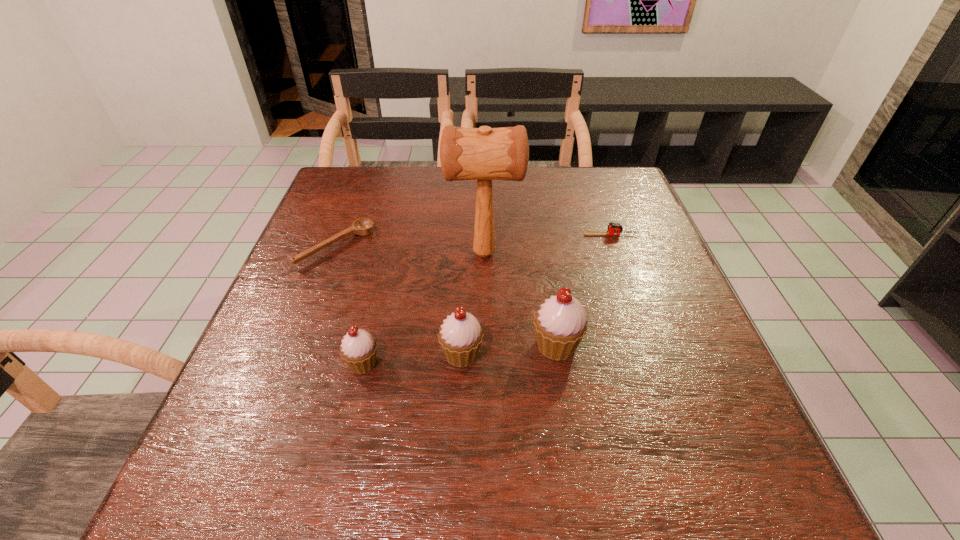
Identify the location of free space located on the back of the second cupcake from right to left. The image size is (960, 540). (466, 233).

At what (x,y) coordinates should I click in order to perform the action: click on vacant space located on the back of the rightmost cupcake. Please return your answer as a coordinate pair (x, y). The image size is (960, 540). Looking at the image, I should click on (540, 238).

The height and width of the screenshot is (540, 960). Find the location of `free region located on the strike surface of the tallest object`. free region located on the strike surface of the tallest object is located at coordinates coord(385,254).

Find the location of a particular element. vacant space located 0.240m on the strike surface of the tallest object is located at coordinates (348, 254).

Locate an element on the screen. The width and height of the screenshot is (960, 540). vacant region located on the strike surface of the tallest object is located at coordinates (336, 254).

This screenshot has width=960, height=540. What are the coordinates of `free space located 0.150m on the left of the rightmost object` in the screenshot? It's located at (526, 235).

You are a GUI agent. You are given a task and a screenshot of the screen. Output one action in this format:
    pyautogui.click(x=<x>, y=<y>)
    Task: Click on the blank space located 0.110m on the front of the leftmost object
    The image size is (960, 540).
    Given the screenshot: What is the action you would take?
    pyautogui.click(x=315, y=306)

I want to click on object present at the left edge, so click(x=364, y=226).

The height and width of the screenshot is (540, 960). Identify the location of object that is at the right edge. (614, 228).

Locate an element on the screen. Image resolution: width=960 pixels, height=540 pixels. blank space at the far edge is located at coordinates (433, 181).